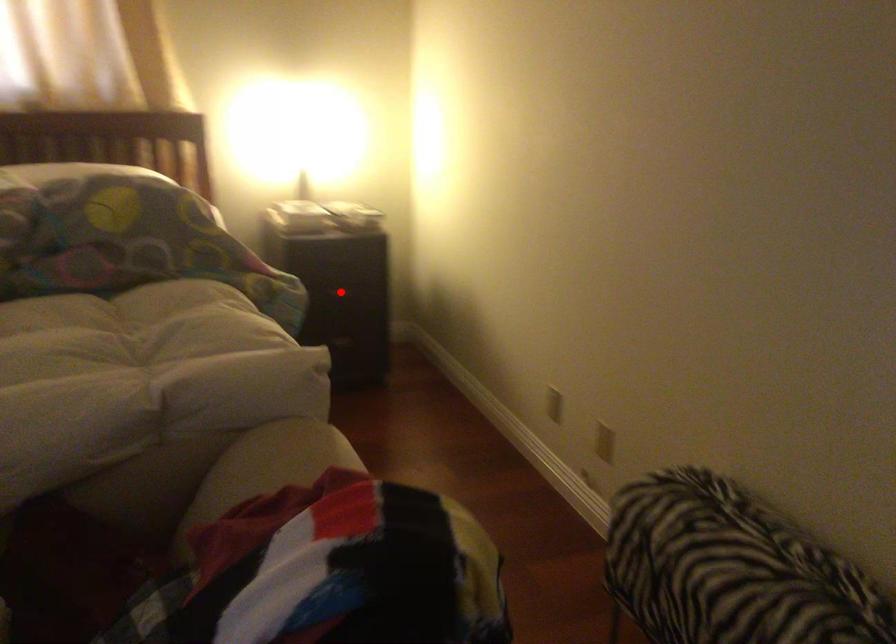
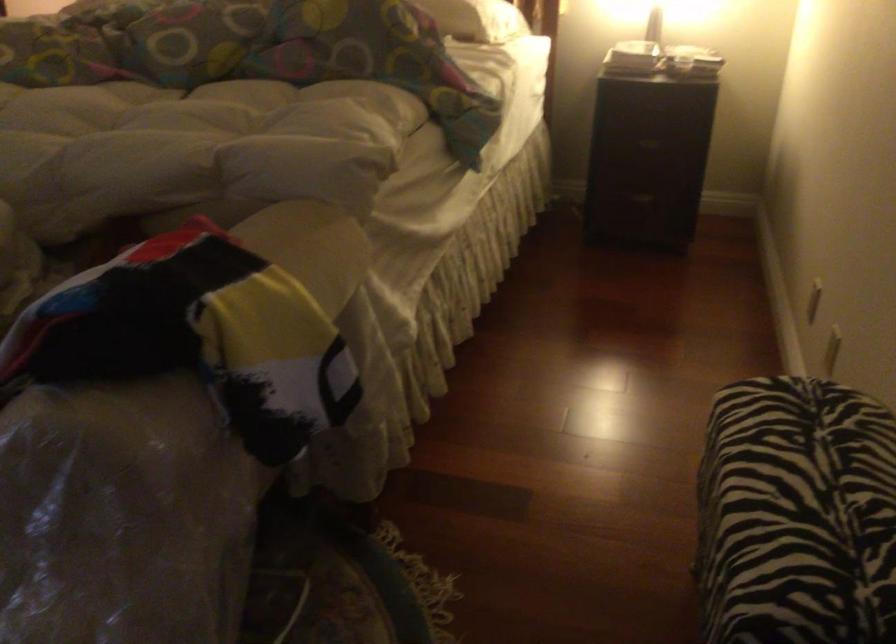
Where in the second image is the point corresponding to the highlighted location from the first image?

(650, 140)